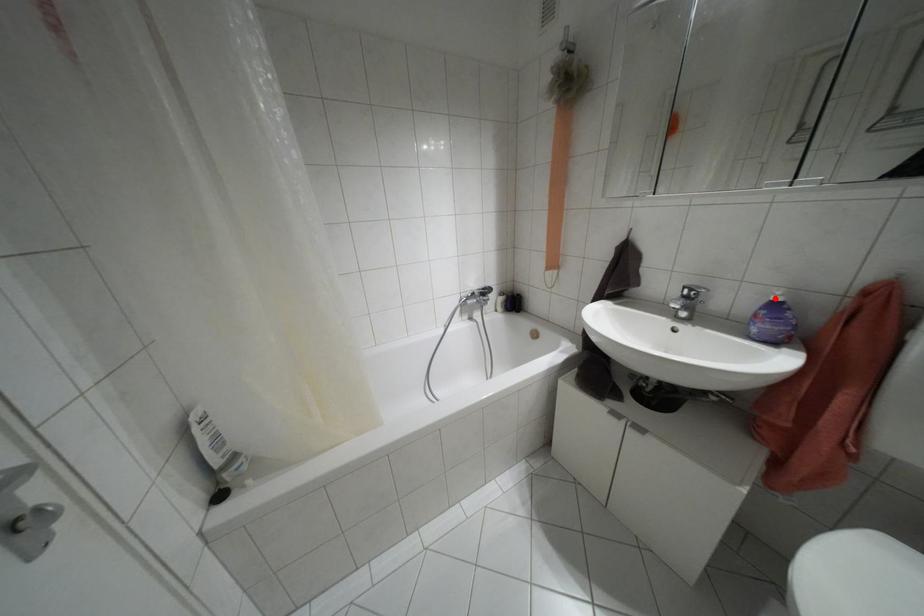
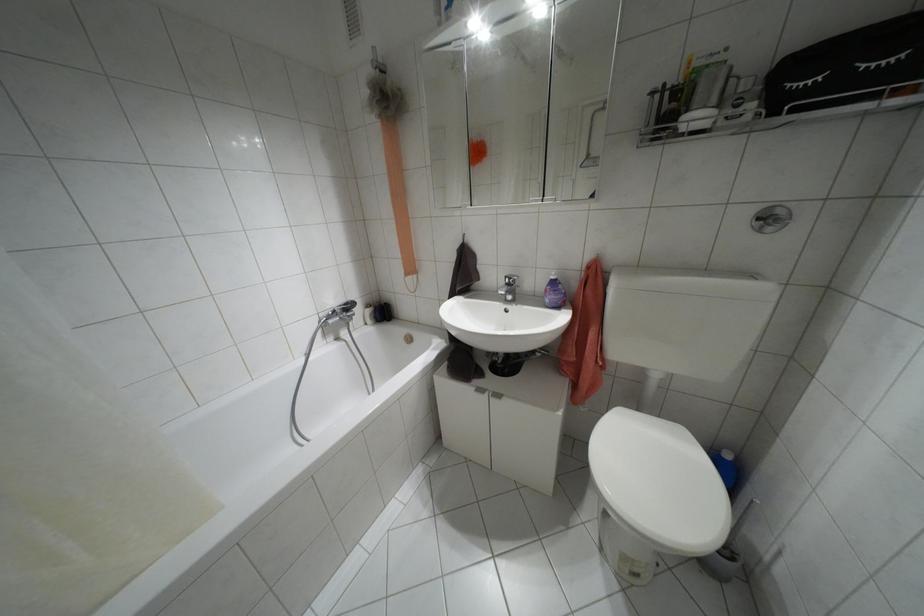
Find the pixel in the second image that matches the highlighted location in the first image.

(552, 277)